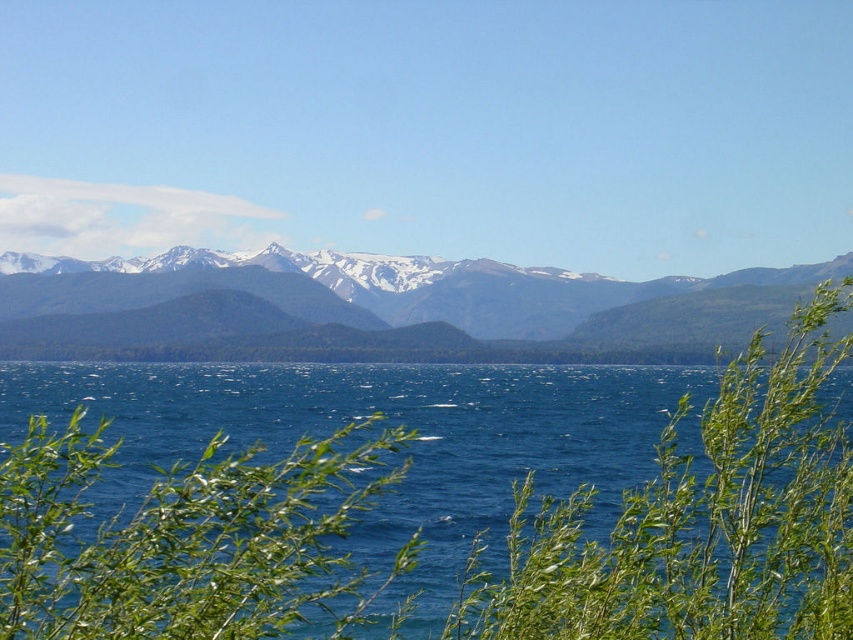
Question: Can you confirm if green leafy plant at lower center is smaller than blue liquid water at center?

Choices:
 (A) no
 (B) yes

Answer: (B)

Question: Which of these objects is positioned closest to the blue liquid water at center?

Choices:
 (A) smokey gray mountains at center
 (B) green leafy plant at lower center

Answer: (A)

Question: Which of these objects is positioned closest to the smokey gray mountains at center?

Choices:
 (A) green leafy plant at lower center
 (B) blue liquid water at center

Answer: (B)

Question: Is green leafy plant at center thinner than smokey gray mountains at center?

Choices:
 (A) no
 (B) yes

Answer: (B)

Question: Which point is closer to the camera taking this photo?

Choices:
 (A) (196, 312)
 (B) (448, 474)
 (C) (486, 624)
 (D) (241, 454)

Answer: (C)

Question: Does green leafy plant at center come behind blue liquid water at center?

Choices:
 (A) yes
 (B) no

Answer: (B)